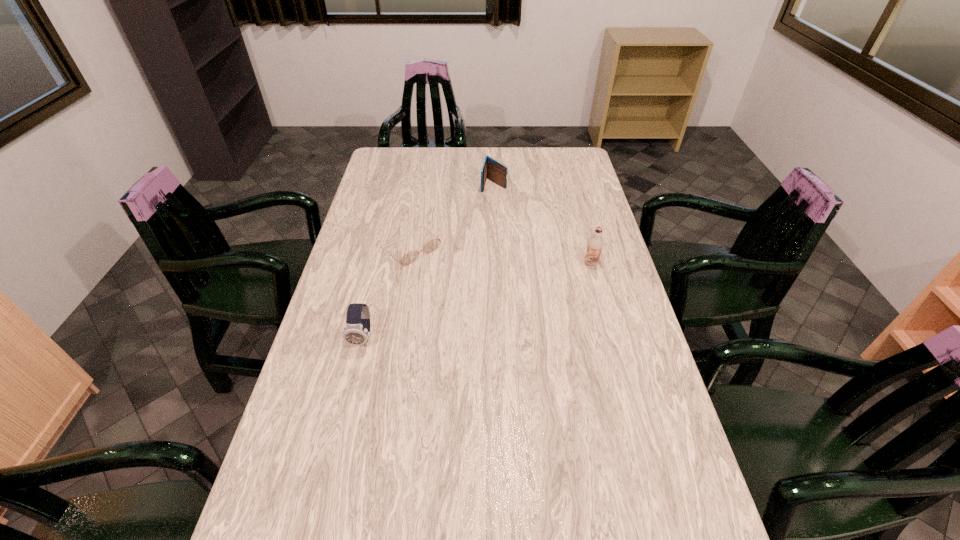
Identify the location of vacant space that's between the tallest object and the wallet. (542, 224).

This screenshot has height=540, width=960. What are the coordinates of `unoccupied area between the watch and the sunglasses` in the screenshot? It's located at (387, 293).

Where is `free space that is in between the third tallest object and the sunglasses`? The image size is (960, 540). free space that is in between the third tallest object and the sunglasses is located at coordinates (452, 217).

Locate which object is the second closest to the chocolate milk. Please provide its 2D coordinates. Your answer should be formatted as a tuple, i.e. [(x, y)], where the tuple contains the x and y coordinates of a point satisfying the conditions above.

[(432, 245)]

Point out which object is positioned as the second nearest to the nearest object. Please provide its 2D coordinates. Your answer should be formatted as a tuple, i.e. [(x, y)], where the tuple contains the x and y coordinates of a point satisfying the conditions above.

[(595, 243)]

Where is `vacant area in the image that satisfies the following two spatial constraints: 1. on the back side of the second object from right to left; 2. on the right side of the sunglasses`? vacant area in the image that satisfies the following two spatial constraints: 1. on the back side of the second object from right to left; 2. on the right side of the sunglasses is located at coordinates (422, 185).

The height and width of the screenshot is (540, 960). Identify the location of free point that satisfies the following two spatial constraints: 1. on the back side of the third tallest object; 2. on the left side of the sunglasses. click(x=422, y=185).

The height and width of the screenshot is (540, 960). I want to click on blank area in the image that satisfies the following two spatial constraints: 1. on the front side of the rightmost object; 2. on the left side of the second object from right to left, so click(496, 263).

Where is `free spot that satisfies the following two spatial constraints: 1. on the front side of the second shortest object; 2. on the right side of the tallest object`? free spot that satisfies the following two spatial constraints: 1. on the front side of the second shortest object; 2. on the right side of the tallest object is located at coordinates (496, 263).